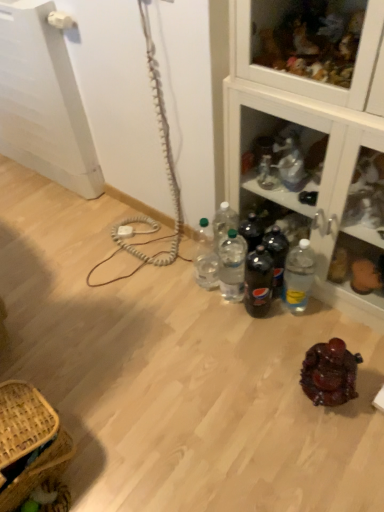
I want to click on free space that is to the left of shiny brown candy at center, so click(273, 396).